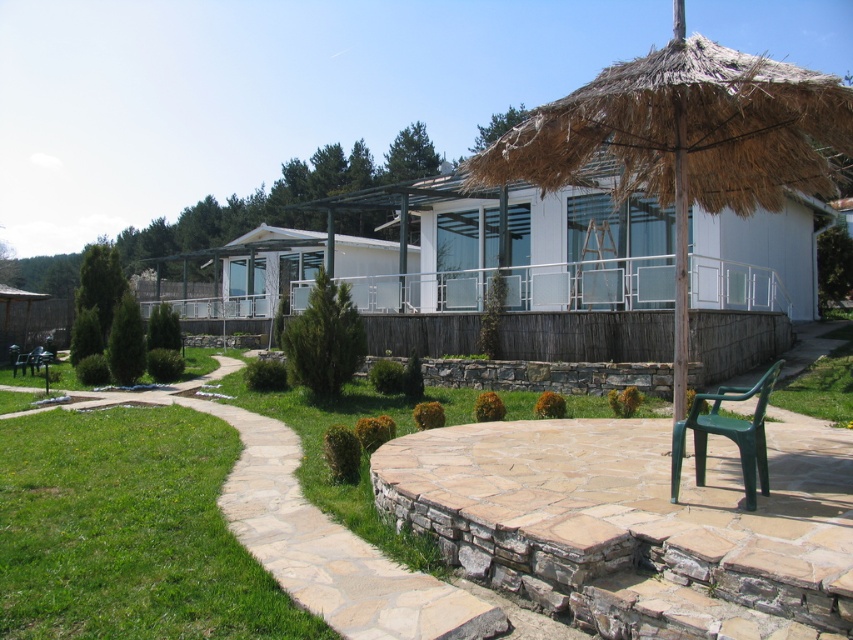
Is point (378, 552) positioned after point (32, 353)?

No, (378, 552) is in front of (32, 353).

Which is behind, point (294, 460) or point (21, 368)?

Positioned behind is point (21, 368).

The width and height of the screenshot is (853, 640). I want to click on natural stone path at center, so click(331, 548).

The width and height of the screenshot is (853, 640). What do you see at coordinates (291, 205) in the screenshot?
I see `white glass hut at center` at bounding box center [291, 205].

Who is more forward, (381, 200) or (254, 442)?

Point (254, 442)

Identify the location of white glass hut at center. (291, 205).

Can you confirm if white glass hut at center is bigger than green plastic chair at center?

Indeed, white glass hut at center has a larger size compared to green plastic chair at center.

Which is below, white glass hut at center or green plastic chair at center?

green plastic chair at center

This screenshot has height=640, width=853. In order to click on white glass hut at center in this screenshot , I will do coord(291,205).

The image size is (853, 640). Identify the location of white glass hut at center. (291, 205).